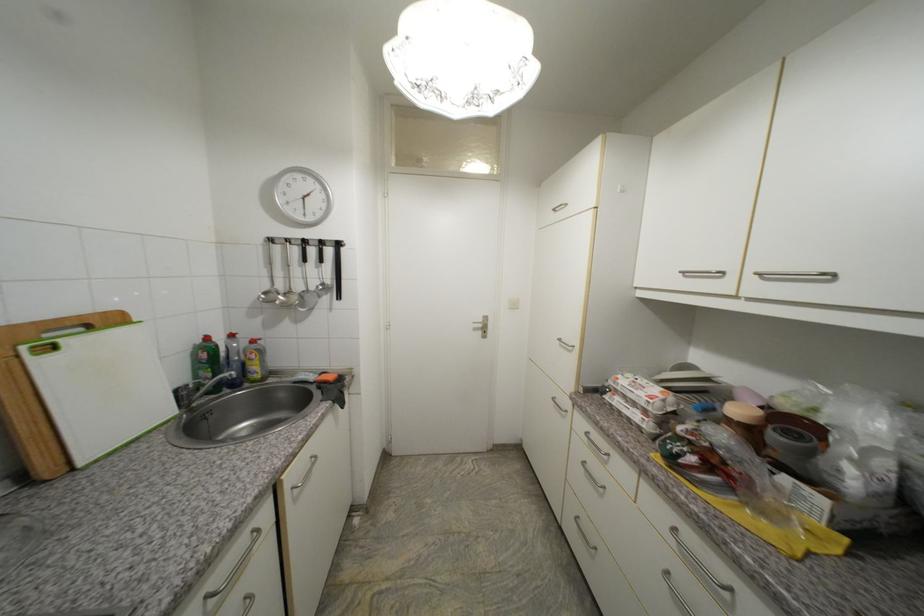
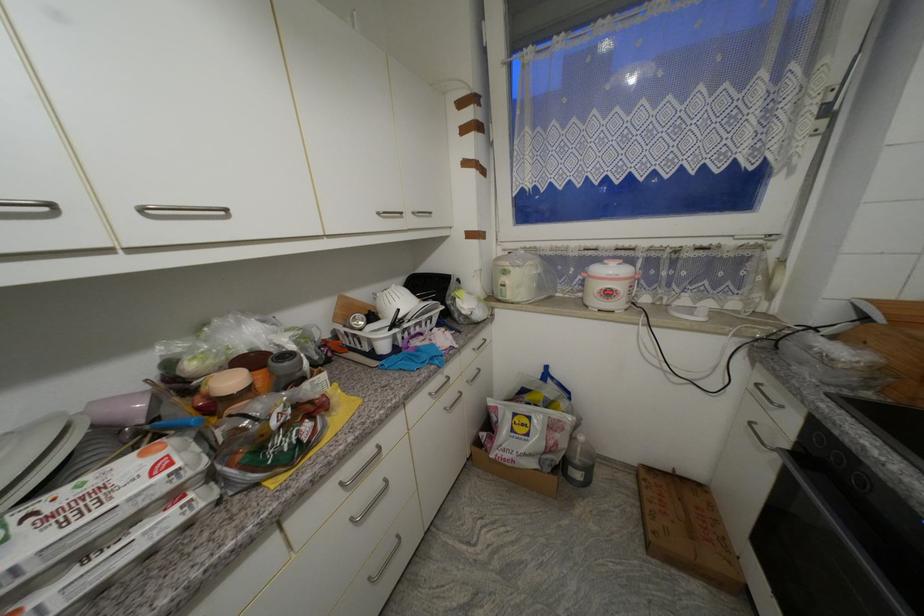
Where in the second image is the point corresponding to point (681, 531) from the first image?

(347, 485)